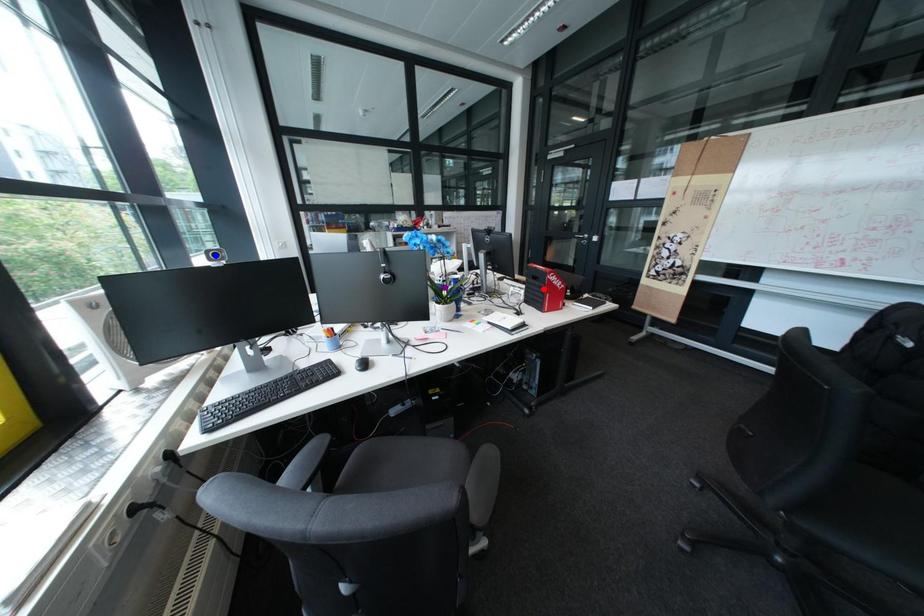
Order these from nearest to farthest:
purple point
blue point
red point

blue point < purple point < red point